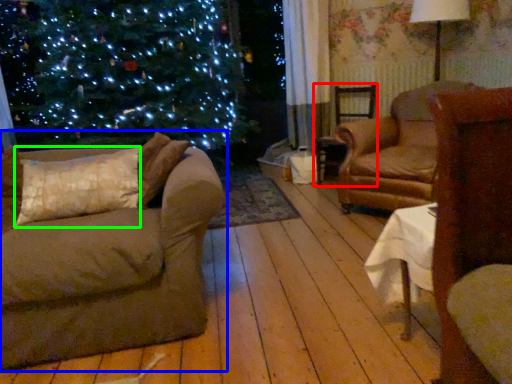
Question: Which object is positioned closest to chair (highlighted by a red box)? Select from studio couch (highlighted by a blue box) and pillow (highlighted by a green box).

Choices:
 (A) studio couch
 (B) pillow

Answer: (B)